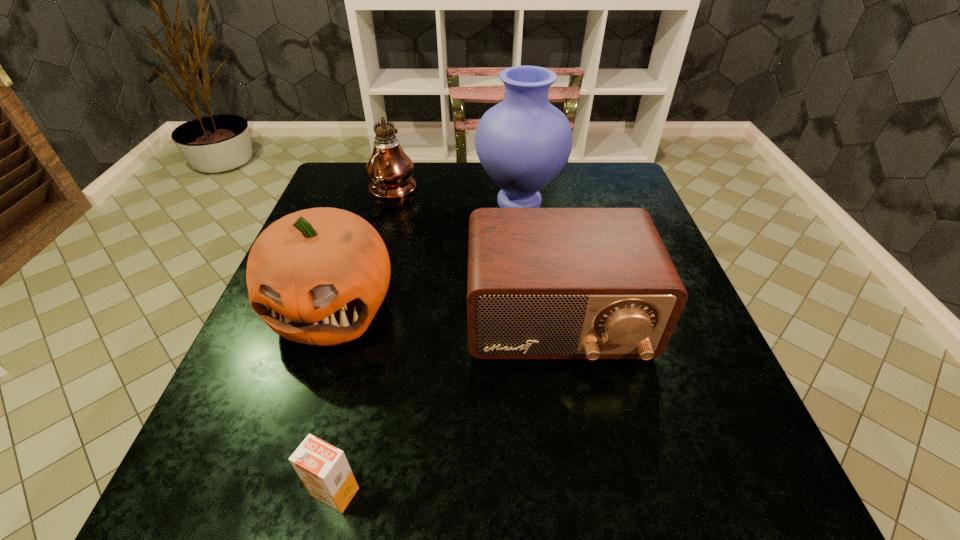
Locate an element on the screen. free spot located 0.090m on the back of the shortest object is located at coordinates (352, 416).

I want to click on oil lamp situated at the far edge, so click(x=390, y=170).

I want to click on vase present at the far edge, so click(x=523, y=142).

The height and width of the screenshot is (540, 960). I want to click on object that is positioned at the near edge, so click(324, 470).

At what (x,y) coordinates should I click in order to perform the action: click on oil lamp that is at the left edge. Please return your answer as a coordinate pair (x, y). Looking at the image, I should click on (390, 170).

Locate an element on the screen. This screenshot has height=540, width=960. pumpkin present at the left edge is located at coordinates (317, 276).

Find the location of a particular element. This screenshot has height=540, width=960. object that is at the right edge is located at coordinates (543, 283).

I want to click on object that is at the far left corner, so click(390, 170).

Find the location of a particular element. This screenshot has width=960, height=540. vacant space at the far edge of the desktop is located at coordinates (571, 180).

You are a GUI agent. You are given a task and a screenshot of the screen. Output one action in this format:
    pyautogui.click(x=<x>, y=<y>)
    Task: Click on the vacant space at the near edge
    
    Given the screenshot: What is the action you would take?
    pyautogui.click(x=300, y=496)